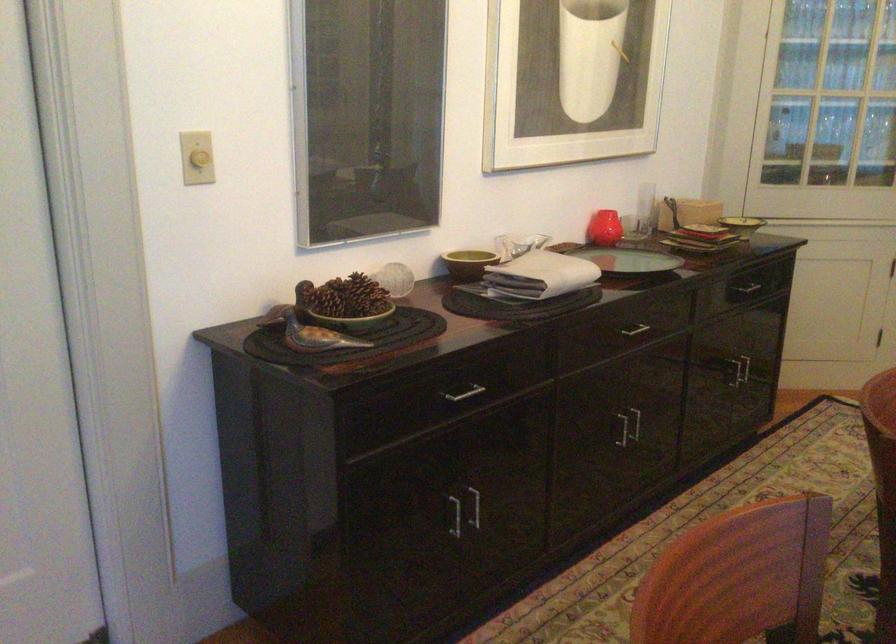
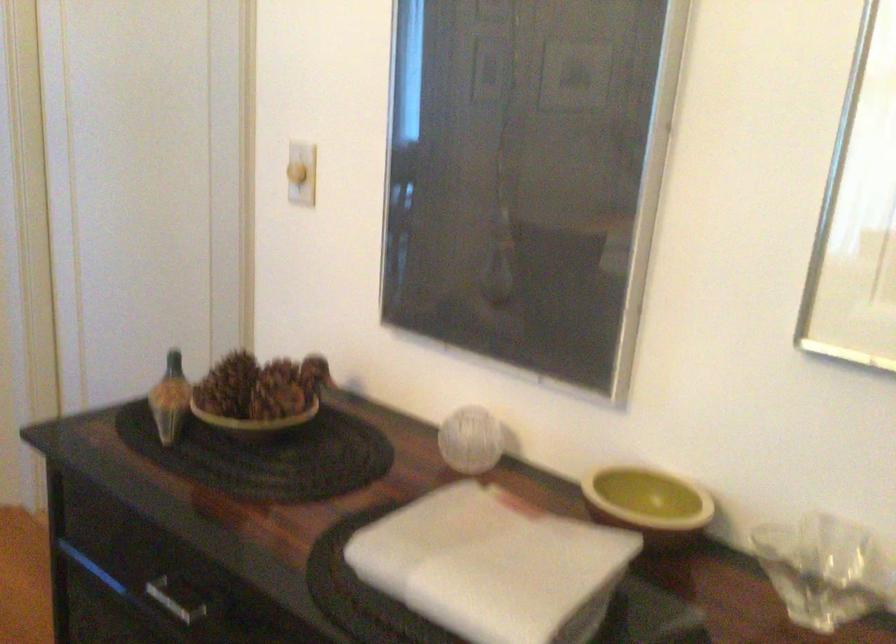
In the second image, find the point that corresponds to (316,315) in the first image.

(169, 399)